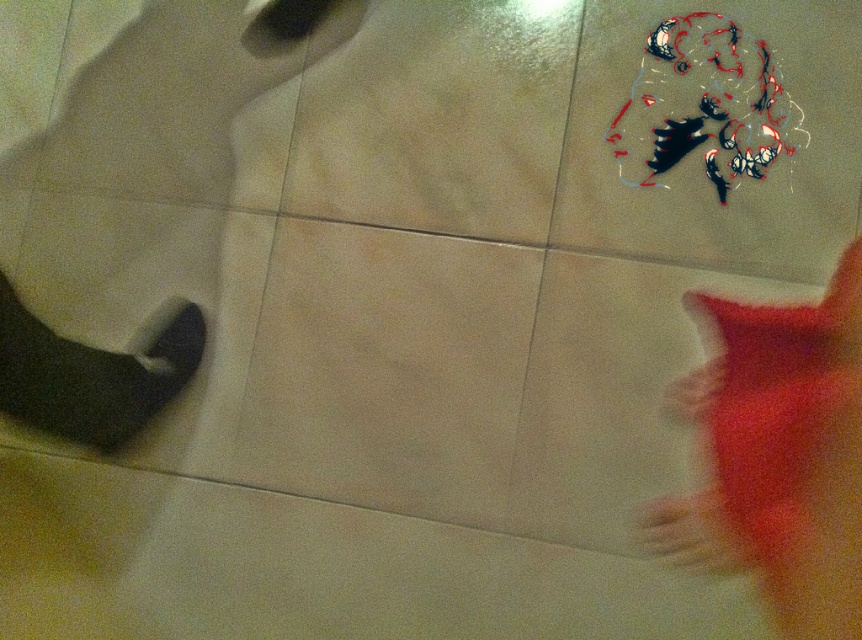
Question: Which object appears closest to the camera in this image?

Choices:
 (A) fluffy orange cat at upper right
 (B) matte beige tile at center

Answer: (A)

Question: Does beige smooth tile at lower center appear on the left side of fluffy orange cat at upper right?

Choices:
 (A) yes
 (B) no

Answer: (A)

Question: Among these objects, which one is nearest to the camera?

Choices:
 (A) beige matte tile at center
 (B) matte gray tile at lower left
 (C) matte beige tile at center
 (D) beige smooth tile at lower center

Answer: (D)

Question: Does beige smooth tile at lower center have a greater width compared to beige matte tile at center?

Choices:
 (A) no
 (B) yes

Answer: (B)

Question: Where is beige smooth tile at lower center located in relation to fluffy orange cat at upper right in the image?

Choices:
 (A) left
 (B) right

Answer: (A)

Question: Estimate the real-world distances between objects in this image. Which object is farther from the fluffy red blanket at lower right?

Choices:
 (A) fluffy orange cat at upper right
 (B) dark gray fabric shoe at lower left
 (C) red fluffy cat at lower right

Answer: (B)